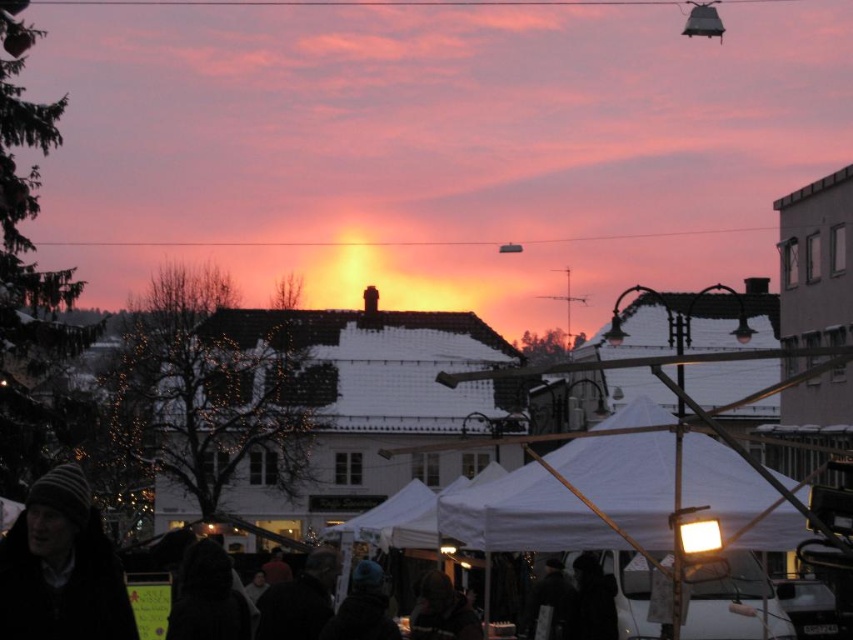
Question: Among these objects, which one is farthest from the camera?

Choices:
 (A) dark brown fur coat at lower center
 (B) dark hooded coat at lower center
 (C) dark gray fabric jacket at lower center
 (D) dark fabric coat at center

Answer: (A)

Question: Is white fabric canopy at center below dark brown fur coat at lower center?

Choices:
 (A) no
 (B) yes

Answer: (A)

Question: Estimate the real-world distances between objects in this image. Which object is closer to the striped knit hat at lower left?

Choices:
 (A) dark blue knit hat at center
 (B) dark hooded coat at lower center

Answer: (B)

Question: Is dark blue knit hat at center further to camera compared to dark fabric coat at center?

Choices:
 (A) yes
 (B) no

Answer: (B)

Question: Which object is the farthest from the dark brown hair at lower center?

Choices:
 (A) striped knit hat at lower left
 (B) white fabric canopy at center
 (C) dark hooded coat at lower center
 (D) dark brown fur coat at lower center

Answer: (A)

Question: Is striped knit hat at lower left smaller than dark gray fabric jacket at lower center?

Choices:
 (A) yes
 (B) no

Answer: (B)